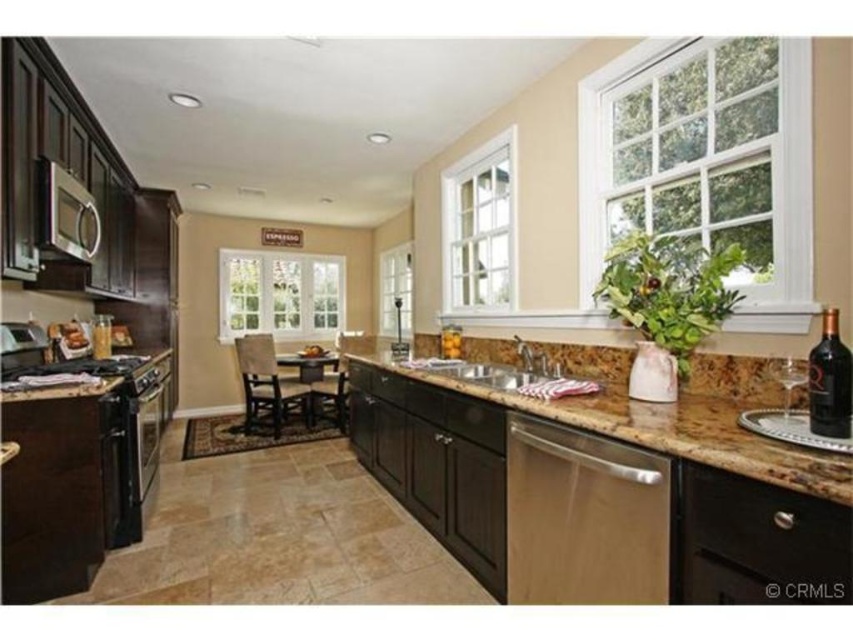
You are a chef who needs to determine which appliance is smaller in size between the white glass window at upper right and the satin silver microwave at upper left. Which one should you choose?

The satin silver microwave at upper left is smaller in size than the white glass window at upper right, so you should choose the satin silver microwave at upper left.

You are a delivery person who needs to place a 6.5 feet long package between the white glass window at upper right and the satin silver microwave at upper left. Can the package fit in the space between them?

The distance between the white glass window at upper right and the satin silver microwave at upper left is 6.38 feet. Since the package is 6.5 feet long, it is slightly longer than the available space. Therefore, the package cannot fit between them.

You are a chef preparing to hang a new kitchen tool. You have two options for placement on the wall behind the counter. The first option is near the white glass window at upper right, and the second is near the black glass bottle at left. Which location is higher up?

The white glass window at upper right is positioned over the black glass bottle at left, so the first option near the white glass window at upper right is higher up.